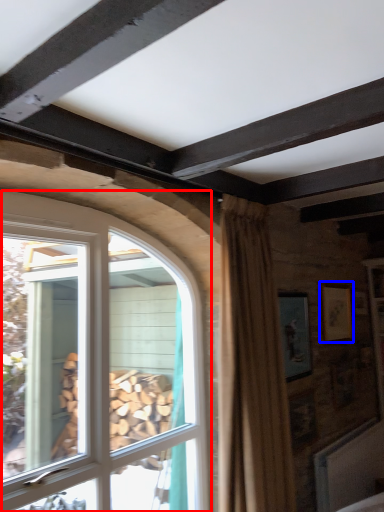
Question: Which of the following is the closest to the observer, window (highlighted by a red box) or picture frame (highlighted by a blue box)?

Choices:
 (A) window
 (B) picture frame

Answer: (A)